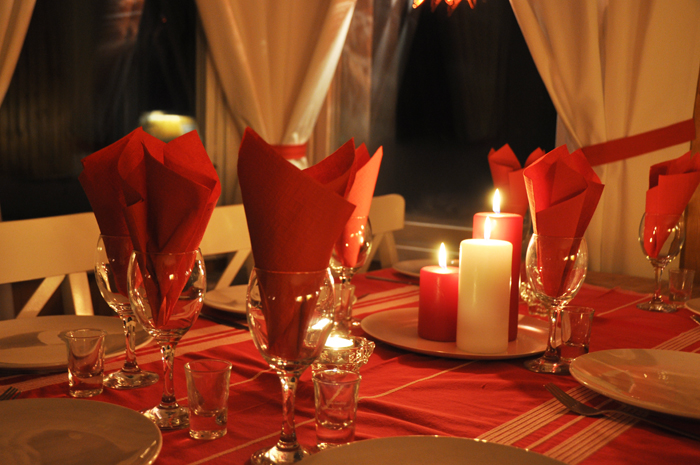
Find the location of a particular element. This screenshot has height=465, width=700. folded napkins is located at coordinates (172, 226), (106, 213), (309, 234), (367, 183), (516, 190), (567, 213), (665, 201).